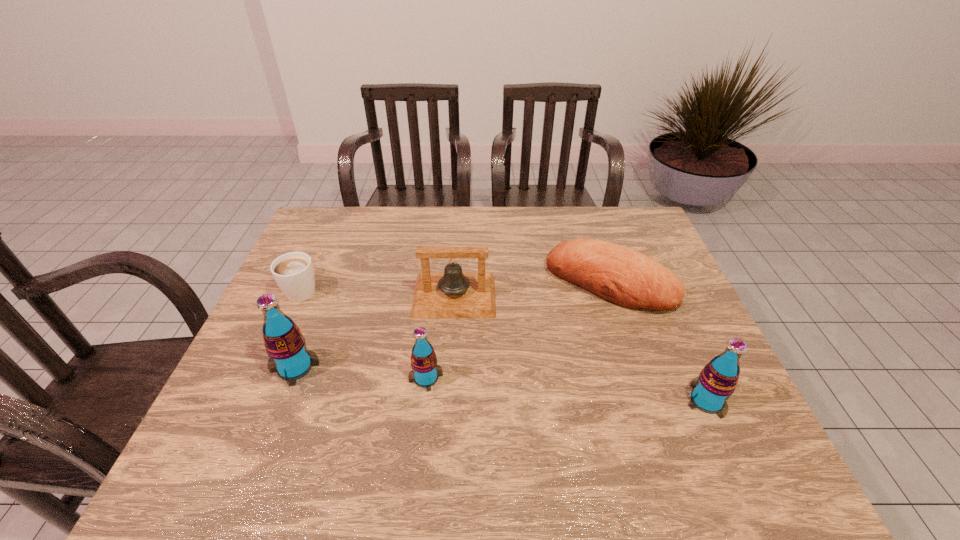
This screenshot has height=540, width=960. What are the coordinates of `vacant area situated 0.350m on the left of the bell` in the screenshot? It's located at (291, 296).

You are a GUI agent. You are given a task and a screenshot of the screen. Output one action in this format:
    pyautogui.click(x=<x>, y=<y>)
    Task: Click on the vacant position located 0.350m with the handle on the side of the cappuccino
    The height and width of the screenshot is (540, 960).
    Given the screenshot: What is the action you would take?
    pyautogui.click(x=338, y=211)

The height and width of the screenshot is (540, 960). In order to click on vacant area situated with the handle on the side of the cappuccino in this screenshot , I will do `click(335, 217)`.

Identify the location of free space located 0.180m with the handle on the side of the cappuccino. Image resolution: width=960 pixels, height=540 pixels. (325, 238).

At what (x,y) coordinates should I click in order to perform the action: click on free space located 0.060m on the left of the bread. Please return your answer as a coordinate pair (x, y). Looking at the image, I should click on (528, 283).

Find the location of a particular element. object that is at the near edge is located at coordinates (717, 381).

Where is `soda at the left edge`? soda at the left edge is located at coordinates (285, 344).

You are a GUI agent. You are given a task and a screenshot of the screen. Output one action in this format:
    pyautogui.click(x=<x>, y=<y>)
    Task: Click on the cappuccino at the left edge
    
    Given the screenshot: What is the action you would take?
    pyautogui.click(x=293, y=272)

Locate an element on the screen. soda situated at the right edge is located at coordinates (717, 381).

The image size is (960, 540). In order to click on bread that is at the right edge in this screenshot , I will do `click(620, 275)`.